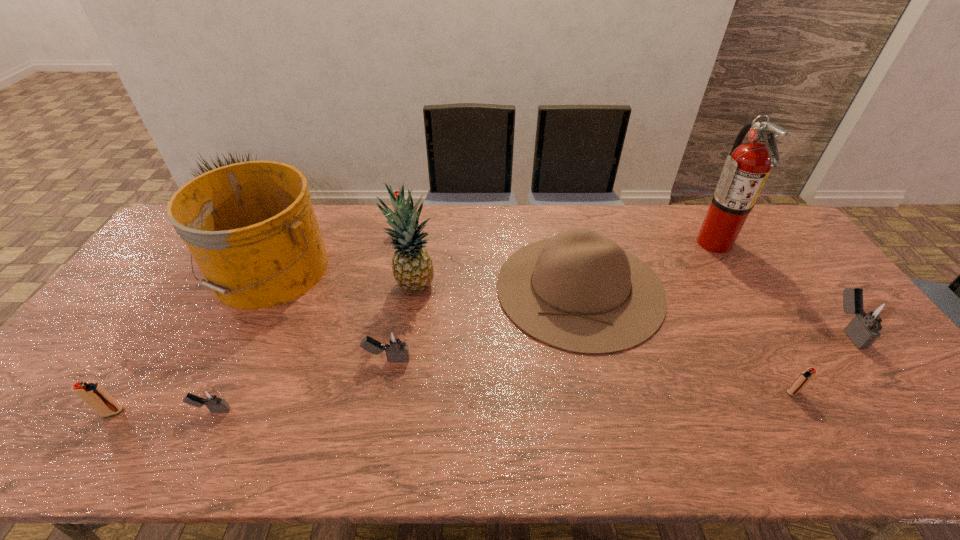
Locate which igniter ranks fifth in proximity to the biggest red igniter. Please provide its 2D coordinates. Your answer should be formatted as a tuple, i.e. [(x, y)], where the tuple contains the x and y coordinates of a point satisfying the conditions above.

[(863, 329)]

Identify which igniter is the fifth nearest to the fire extinguisher. Please provide its 2D coordinates. Your answer should be formatted as a tuple, i.e. [(x, y)], where the tuple contains the x and y coordinates of a point satisfying the conditions above.

[(209, 396)]

Locate which red igniter ranks second in proximity to the fourth tallest object. Please provide its 2D coordinates. Your answer should be formatted as a tuple, i.e. [(x, y)], where the tuple contains the x and y coordinates of a point satisfying the conditions above.

[(396, 193)]

At what (x,y) coordinates should I click in order to perform the action: click on the second closest red igniter to the second igniter from left to right. Please return your answer as a coordinate pair (x, y). The image size is (960, 540). Looking at the image, I should click on (396, 193).

Identify which gray igniter is the closest to the tallest object. Please provide its 2D coordinates. Your answer should be formatted as a tuple, i.e. [(x, y)], where the tuple contains the x and y coordinates of a point satisfying the conditions above.

[(863, 329)]

Find the location of a particular element. The height and width of the screenshot is (540, 960). gray igniter that can be found as the closest to the second gray igniter from left to right is located at coordinates (209, 396).

Locate an element on the screen. free space that satisfies the following two spatial constraints: 1. on the nozzle side of the tallest object; 2. on the front side of the yellow pineapple is located at coordinates (740, 286).

Identify the location of free spot that satisfies the following two spatial constraints: 1. on the front side of the second gray igniter from left to right; 2. on the right side of the smallest red igniter. (381, 392).